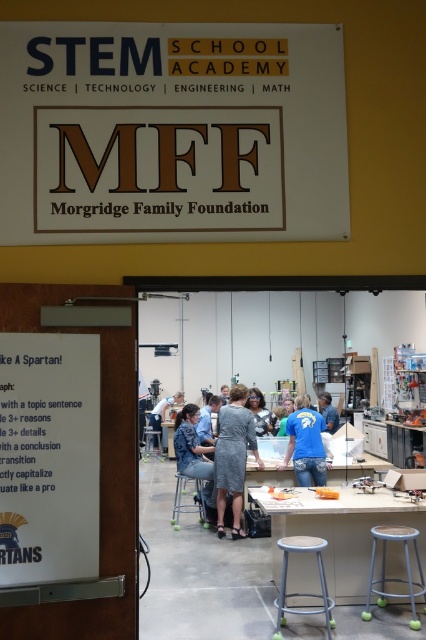
Which is more to the right, blue denim jeans at center or metallic silver bar stool at center?

→ blue denim jeans at center

Does blue denim jeans at center appear on the right side of metallic silver bar stool at center?

Indeed, blue denim jeans at center is positioned on the right side of metallic silver bar stool at center.

Does point (308, 461) come closer to viewer compared to point (175, 472)?

Yes.

Where is `blue denim jeans at center`? blue denim jeans at center is located at coordinates (305, 444).

Can you confirm if metallic silver stool at center is shorter than metallic silver bar stool at center?

Correct, metallic silver stool at center is not as tall as metallic silver bar stool at center.

Which of these two, metallic silver stool at center or metallic silver bar stool at center, stands taller?

metallic silver bar stool at center

This screenshot has width=426, height=640. What are the coordinates of `metallic silver stool at center` in the screenshot? It's located at (x=302, y=593).

At what (x,y) coordinates should I click in order to perform the action: click on metallic silver stool at center. Please return your answer as a coordinate pair (x, y). The width and height of the screenshot is (426, 640). Looking at the image, I should click on (302, 593).

Does gray fabric dress at center have a lesser width compared to gray fabric bar stool at center?

Incorrect, gray fabric dress at center's width is not less than gray fabric bar stool at center's.

Is point (155, 404) behind point (143, 444)?

Yes.

What are the coordinates of `gray fabric dress at center` in the screenshot? It's located at (164, 410).